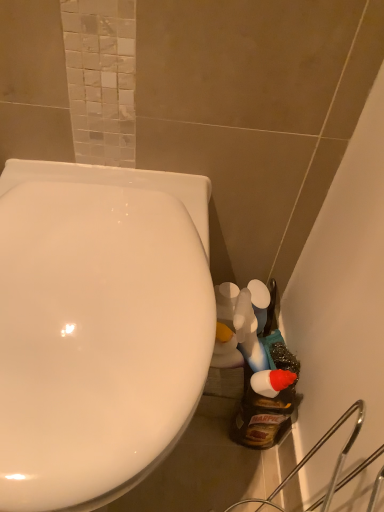
At what (x,y) coordinates should I click in order to perform the action: click on blank space situated above white glossy toilet at left (from a real-world perspective). Please return your answer as a coordinate pair (x, y). The height and width of the screenshot is (512, 384). Looking at the image, I should click on (95, 283).